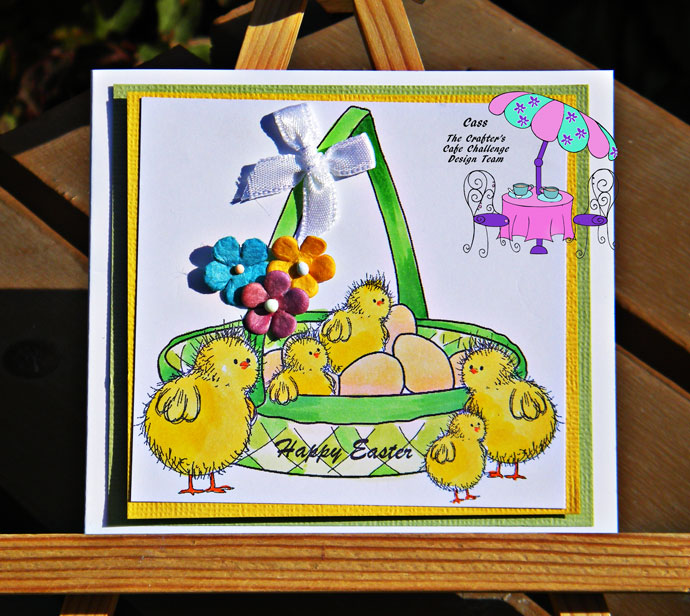
The width and height of the screenshot is (690, 616). I want to click on two coffee cups, so click(520, 191), click(550, 193).